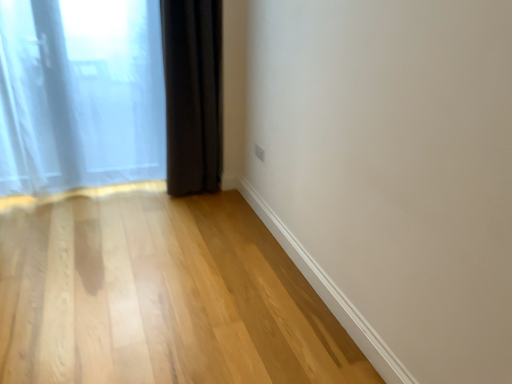
Question: From a real-world perspective, does dark matte curtain at lower left, which ranks as the first curtain in right-to-left order, stand above translucent fabric curtain at left, marked as the 1th curtain in a left-to-right arrangement?

Choices:
 (A) yes
 (B) no

Answer: (A)

Question: Does dark matte curtain at lower left, which ranks as the first curtain in right-to-left order, appear on the right side of translucent fabric curtain at left, placed as the second curtain when sorted from right to left?

Choices:
 (A) yes
 (B) no

Answer: (A)

Question: Considering the relative sizes of dark matte curtain at lower left, which ranks as the first curtain in right-to-left order, and translucent fabric curtain at left, marked as the 1th curtain in a left-to-right arrangement, in the image provided, is dark matte curtain at lower left, which ranks as the first curtain in right-to-left order, taller than translucent fabric curtain at left, marked as the 1th curtain in a left-to-right arrangement,?

Choices:
 (A) no
 (B) yes

Answer: (A)

Question: Does dark matte curtain at lower left, acting as the 2th curtain starting from the left, turn towards translucent fabric curtain at left, placed as the second curtain when sorted from right to left?

Choices:
 (A) no
 (B) yes

Answer: (A)

Question: Considering the relative sizes of dark matte curtain at lower left, which ranks as the first curtain in right-to-left order, and translucent fabric curtain at left, placed as the second curtain when sorted from right to left, in the image provided, is dark matte curtain at lower left, which ranks as the first curtain in right-to-left order, shorter than translucent fabric curtain at left, placed as the second curtain when sorted from right to left,?

Choices:
 (A) no
 (B) yes

Answer: (B)

Question: Considering their positions, is light wood floor at lower left located in front of or behind translucent fabric curtain at left, marked as the 1th curtain in a left-to-right arrangement?

Choices:
 (A) front
 (B) behind

Answer: (A)

Question: In terms of width, does light wood floor at lower left look wider or thinner when compared to translucent fabric curtain at left, marked as the 1th curtain in a left-to-right arrangement?

Choices:
 (A) wide
 (B) thin

Answer: (A)

Question: In the image, is light wood floor at lower left on the left side or the right side of translucent fabric curtain at left, marked as the 1th curtain in a left-to-right arrangement?

Choices:
 (A) right
 (B) left

Answer: (A)

Question: Is light wood floor at lower left taller or shorter than translucent fabric curtain at left, marked as the 1th curtain in a left-to-right arrangement?

Choices:
 (A) tall
 (B) short

Answer: (B)

Question: Considering the relative positions of translucent fabric curtain at left, placed as the second curtain when sorted from right to left, and dark matte curtain at lower left, which ranks as the first curtain in right-to-left order, in the image provided, is translucent fabric curtain at left, placed as the second curtain when sorted from right to left, to the left or to the right of dark matte curtain at lower left, which ranks as the first curtain in right-to-left order,?

Choices:
 (A) left
 (B) right

Answer: (A)

Question: Looking at the image, does translucent fabric curtain at left, placed as the second curtain when sorted from right to left, seem bigger or smaller compared to dark matte curtain at lower left, acting as the 2th curtain starting from the left?

Choices:
 (A) small
 (B) big

Answer: (B)

Question: From a real-world perspective, is translucent fabric curtain at left, placed as the second curtain when sorted from right to left, positioned above or below dark matte curtain at lower left, acting as the 2th curtain starting from the left?

Choices:
 (A) below
 (B) above

Answer: (A)

Question: From the image's perspective, is translucent fabric curtain at left, marked as the 1th curtain in a left-to-right arrangement, located above or below dark matte curtain at lower left, which ranks as the first curtain in right-to-left order?

Choices:
 (A) above
 (B) below

Answer: (B)

Question: From the image's perspective, relative to light wood floor at lower left, is dark matte curtain at lower left, acting as the 2th curtain starting from the left, above or below?

Choices:
 (A) above
 (B) below

Answer: (A)

Question: Is dark matte curtain at lower left, which ranks as the first curtain in right-to-left order, wider or thinner than light wood floor at lower left?

Choices:
 (A) thin
 (B) wide

Answer: (A)